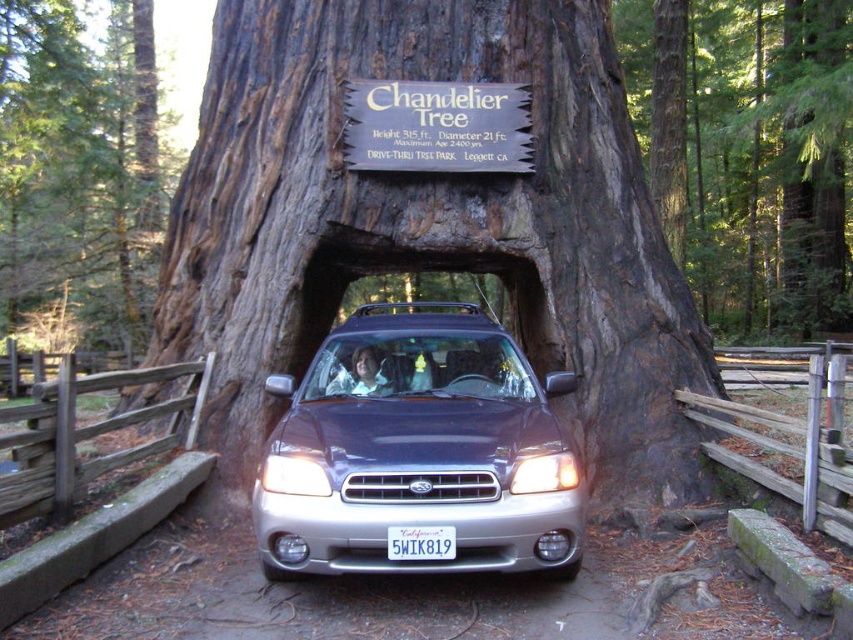
From the picture: You are driving a car that is 2 meters wide. You want to drive through the hollowed trunk of the smooth bark tree at center. Can your car fit through the trunk if the satin silver suv at center is currently parked there?

The satin silver suv at center has a lesser width compared to smooth bark tree at center. Since your car is 2 meters wide and the SUV is narrower than the tree trunk, your car should also fit through the trunk as long as the SUV is parked there, provided the trunk is wide enough to accommodate both vehicles side by side. However, if the SUV is already occupying part of the trunk, there might not be enough space left for your car. Please check the available space carefully before attempting to drive through.

You are a tour guide at the Drive Thru Tree Park. A visitor asks if the satin silver suv at center can safely pass through the hollowed trunk of the Chandelier Tree. Based on the information provided, how would you respond?

The satin silver suv at center is 9.00 feet away from the hollowed trunk of the Chandelier Tree. However, the question of whether it can safely pass through depends on the trunk opening size. The provided information does not specify the trunk opening dimensions, so I cannot confirm if the SUV can pass through safely.